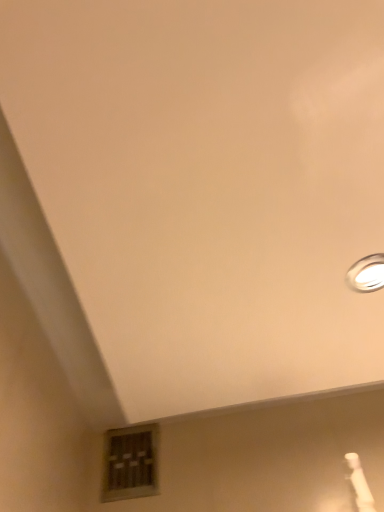
Question: Would you say white glossy lamp at upper right is a long distance from wooden window at lower center?

Choices:
 (A) no
 (B) yes

Answer: (A)

Question: From a real-world perspective, is white glossy lamp at upper right on top of wooden window at lower center?

Choices:
 (A) no
 (B) yes

Answer: (A)

Question: Is white glossy lamp at upper right with wooden window at lower center?

Choices:
 (A) no
 (B) yes

Answer: (A)

Question: Is white glossy lamp at upper right to the left of wooden window at lower center from the viewer's perspective?

Choices:
 (A) yes
 (B) no

Answer: (B)

Question: Can you confirm if white glossy lamp at upper right is smaller than wooden window at lower center?

Choices:
 (A) yes
 (B) no

Answer: (A)

Question: Is white glossy lamp at upper right turned away from wooden window at lower center?

Choices:
 (A) yes
 (B) no

Answer: (B)

Question: From the image's perspective, is wooden window at lower center beneath white glossy lamp at upper right?

Choices:
 (A) yes
 (B) no

Answer: (A)

Question: Can you confirm if wooden window at lower center is bigger than white glossy lamp at upper right?

Choices:
 (A) no
 (B) yes

Answer: (B)

Question: Is white glossy lamp at upper right surrounded by wooden window at lower center?

Choices:
 (A) yes
 (B) no

Answer: (B)

Question: Is wooden window at lower center oriented towards white glossy lamp at upper right?

Choices:
 (A) yes
 (B) no

Answer: (B)

Question: From the image's perspective, does wooden window at lower center appear higher than white glossy lamp at upper right?

Choices:
 (A) no
 (B) yes

Answer: (A)

Question: Would you say wooden window at lower center is a long distance from white glossy lamp at upper right?

Choices:
 (A) yes
 (B) no

Answer: (B)

Question: From the image's perspective, is wooden window at lower center above or below white glossy lamp at upper right?

Choices:
 (A) below
 (B) above

Answer: (A)